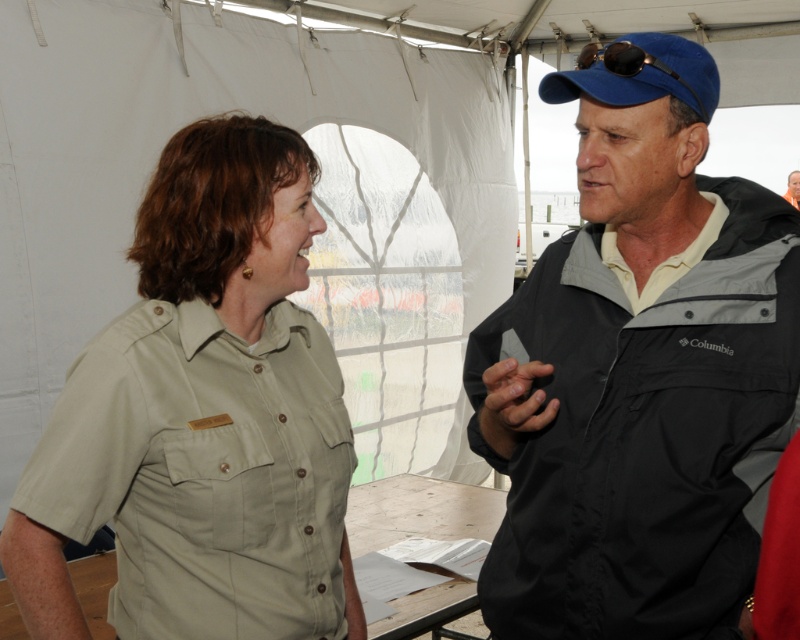
You are a photographer standing at a distance of 2 meters from the black fabric jacket at upper right. You want to take a photo of the two people under the white tent. Will you be able to capture both individuals in the frame without moving closer?

The two individuals are 1.19 meters apart. Since you are 2 meters away from the black fabric jacket at upper right, you can capture both individuals in the frame without moving closer as the distance between them is within the camera view at that range.

Looking at this image, you are a photographer trying to capture a candid shot of the two people under the white tent. You want to ensure that both the satin khaki shirt at center and the matte black jacket at upper right are clearly visible in the frame. Based on their positions, which object is positioned lower in the image?

The satin khaki shirt at center is located below the matte black jacket at upper right, so the satin khaki shirt at center is positioned lower in the image.

You are a tailor trying to determine which garment requires more fabric to make between the black fabric jacket at upper right and the satin khaki shirt at center. Based on the description provided, which one would need more fabric?

The black fabric jacket at upper right might be wider than the satin khaki shirt at center, so it would likely require more fabric to make.